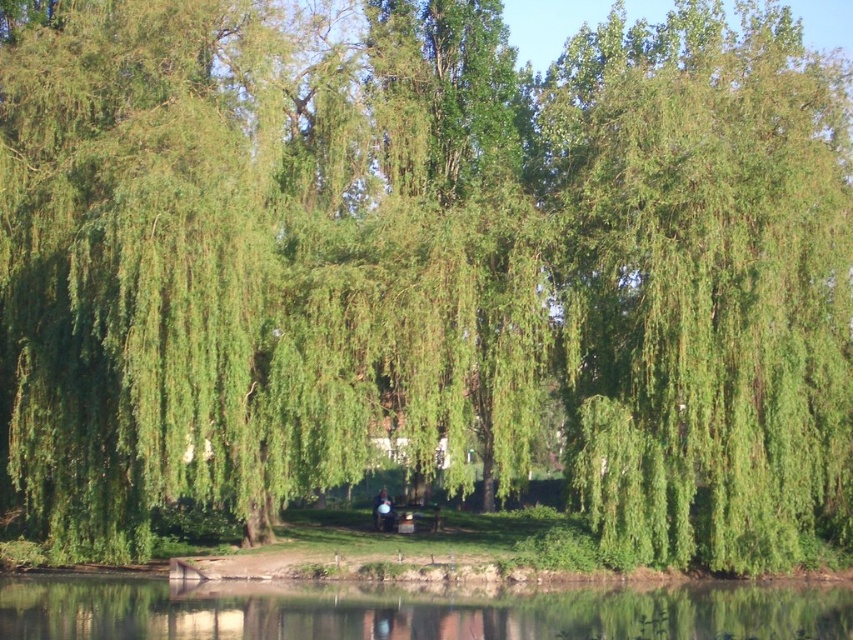
You are a painter standing at the edge of the water. You want to paint the green leafy willow at upper right and the transparent water at bottom. Which object should you focus on first if you want to paint the larger one first?

The green leafy willow at upper right is larger in size than the transparent water at bottom, so you should focus on painting the green leafy willow at upper right first.

You are standing in the serene natural scene described. You want to take a photo of the smooth skin person at center without the green leafy willow at upper right blocking the view. Is the willow tall enough to interfere with your shot?

The green leafy willow at upper right is much taller than the smooth skin person at center, so it may block the view depending on the angle and distance. Position yourself lower or move closer to ensure the willow doesn not obstruct the photo.

You are a photographer trying to capture the reflection of the smooth skin person at center in the transparent water at bottom. Based on the scene description, can you confirm if the reflection will be visible?

The transparent water at bottom is positioned on the right side of smooth skin person at center. Since the water is transparent and calm, the reflection of the smooth skin person at center should be clearly visible in the water.